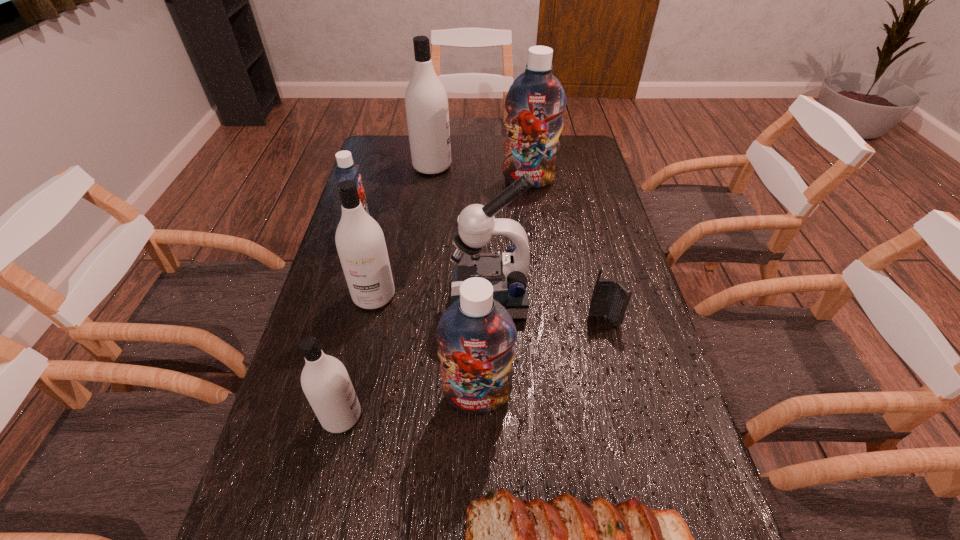
The width and height of the screenshot is (960, 540). In order to click on the smallest white shampoo in this screenshot , I will do `click(325, 381)`.

At what (x,y) coordinates should I click in order to perform the action: click on the second shortest object. Please return your answer as a coordinate pair (x, y). The image size is (960, 540). Looking at the image, I should click on (609, 298).

The width and height of the screenshot is (960, 540). Identify the location of vacant area situated 0.390m on the front-facing side of the biggest white shampoo. point(555,166).

You are a GUI agent. You are given a task and a screenshot of the screen. Output one action in this format:
    pyautogui.click(x=<x>, y=<y>)
    Task: Click on the vacant region located on the front label of the biggest blue shampoo
    The width and height of the screenshot is (960, 540).
    Given the screenshot: What is the action you would take?
    pyautogui.click(x=534, y=218)

What are the coordinates of `blank space located on the back of the gray microscope` in the screenshot? It's located at (488, 215).

Find the location of a particular element. Image resolution: width=960 pixels, height=540 pixels. free spot located on the front-facing side of the third nearest shampoo is located at coordinates (355, 379).

Find the location of a particular element. vacant space situated on the front label of the fifth shampoo from left to right is located at coordinates (476, 520).

This screenshot has width=960, height=540. Find the location of `free space located on the front label of the fourth nearest shampoo`. free space located on the front label of the fourth nearest shampoo is located at coordinates click(x=410, y=230).

This screenshot has height=540, width=960. I want to click on free space located on the front-facing side of the nearest white shampoo, so click(517, 416).

The width and height of the screenshot is (960, 540). I want to click on vacant space located on the keyboard of the cellular telephone, so click(x=626, y=408).